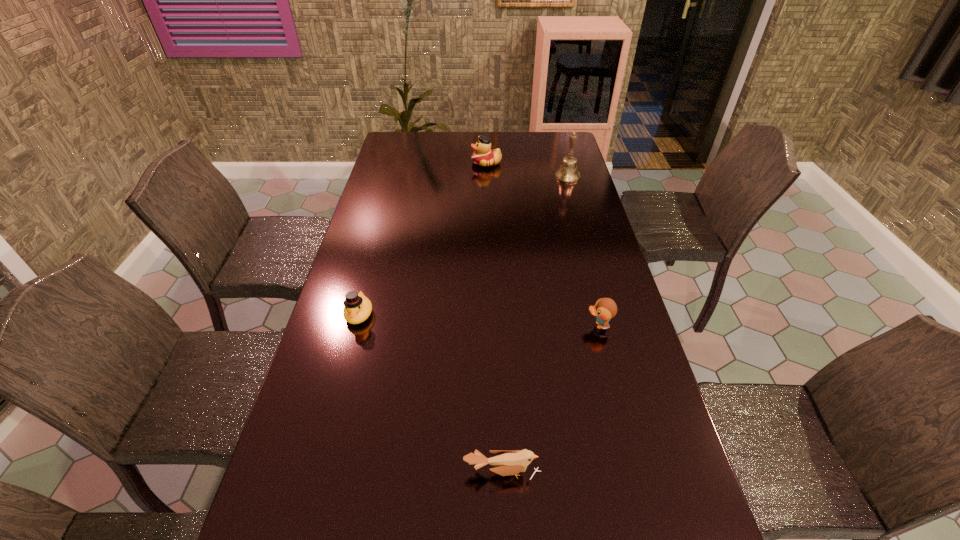
Identify the location of the second farthest object. (568, 173).

Find the location of a particular element. bell is located at coordinates (568, 173).

Identify the location of the farthest duck. (484, 156).

Find the location of `the second duck from left to right`. the second duck from left to right is located at coordinates (484, 156).

Find the location of a particular element. the rightmost duck is located at coordinates pyautogui.click(x=605, y=309).

Identify the location of the leftmost duck. The width and height of the screenshot is (960, 540). (358, 307).

The height and width of the screenshot is (540, 960). I want to click on the nearest object, so click(x=507, y=463).

Find the location of a particular element. The width and height of the screenshot is (960, 540). the shortest object is located at coordinates (507, 463).

Where is `free region located on the left of the bell`? The height and width of the screenshot is (540, 960). free region located on the left of the bell is located at coordinates (491, 177).

The height and width of the screenshot is (540, 960). Identify the location of free space located on the face of the farthest object. (396, 163).